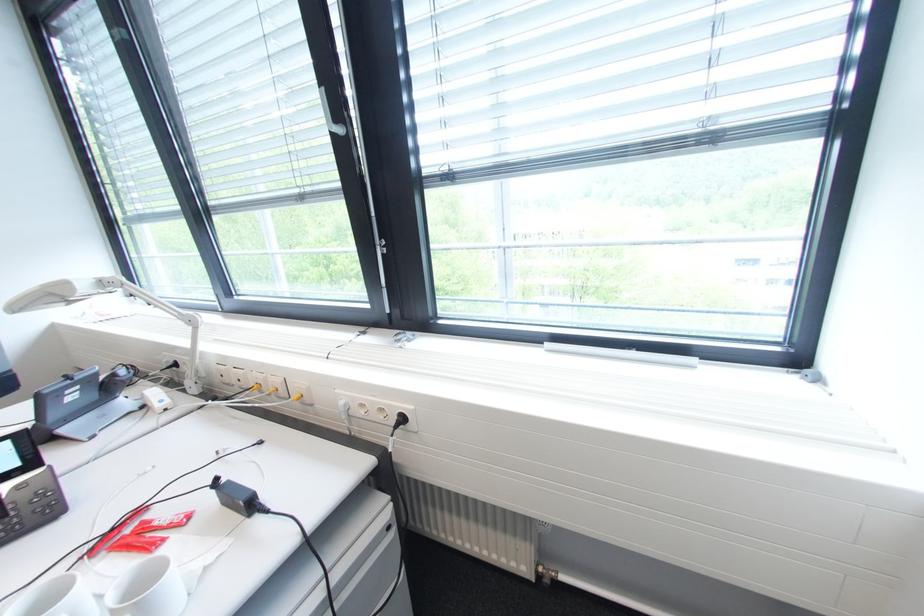
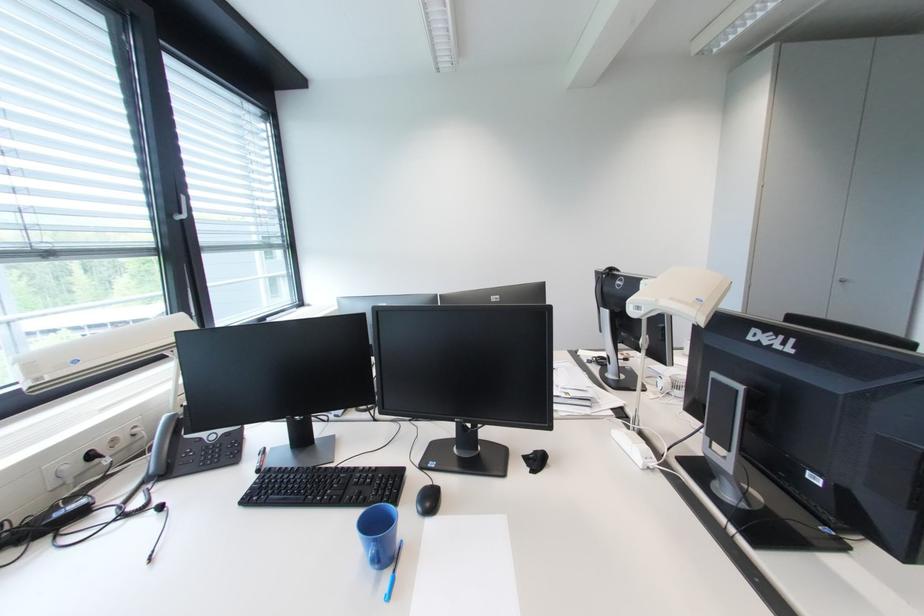
Where in the second image is the point corresponding to pixel 181 367 from the first image?

(98, 458)